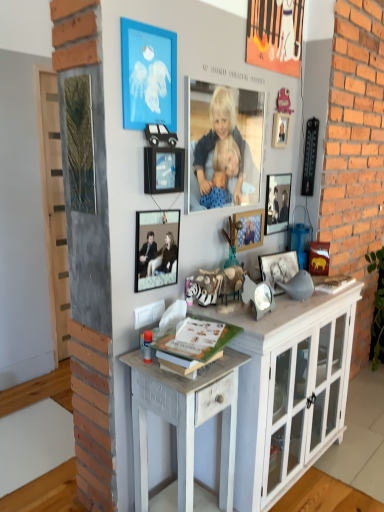
Find the location of a particular element. free point above green matte book at center (from a real-world perspective) is located at coordinates (200, 331).